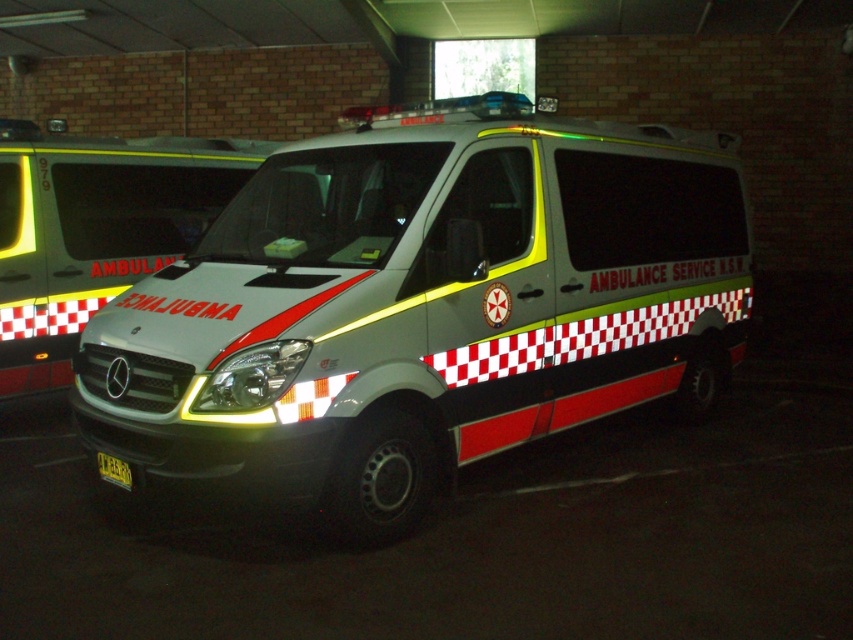
Question: Does matte gray ambulance at center have a smaller size compared to white glossy ambulance at center?

Choices:
 (A) yes
 (B) no

Answer: (B)

Question: Can you confirm if matte gray ambulance at center is positioned above white glossy ambulance at center?

Choices:
 (A) no
 (B) yes

Answer: (A)

Question: Which object is farther from the camera taking this photo?

Choices:
 (A) matte gray ambulance at center
 (B) white glossy ambulance at center

Answer: (B)

Question: Which object is farther from the camera taking this photo?

Choices:
 (A) matte gray ambulance at center
 (B) white glossy ambulance at center

Answer: (B)

Question: Can you confirm if matte gray ambulance at center is wider than white glossy ambulance at center?

Choices:
 (A) yes
 (B) no

Answer: (A)